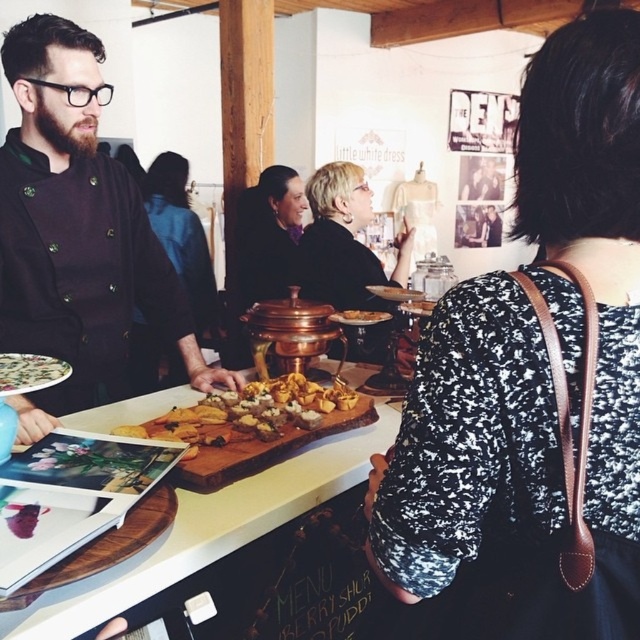
From the picture: Between black textured dress at center and matte black dress at center, which one appears on the right side from the viewer's perspective?

From the viewer's perspective, black textured dress at center appears more on the right side.

Who is positioned more to the left, black textured dress at center or matte black dress at center?

From the viewer's perspective, matte black dress at center appears more on the left side.

Which is behind, point (440, 333) or point (344, 259)?

The point (344, 259) is behind.

The image size is (640, 640). Find the location of `black textured dress at center`. black textured dress at center is located at coordinates (532, 387).

Who is positioned more to the left, matte black dress at center or matte white plate at lower left?

matte white plate at lower left

Does matte black dress at center have a larger size compared to matte white plate at lower left?

Indeed, matte black dress at center has a larger size compared to matte white plate at lower left.

Where is `matte black dress at center`? This screenshot has width=640, height=640. matte black dress at center is located at coordinates click(344, 243).

Is point (77, 609) positioned before point (33, 364)?

Yes, point (77, 609) is closer to viewer.

Identify the location of wooden cutting board at center. (236, 518).

Where is `wooden cutting board at center`? wooden cutting board at center is located at coordinates (236, 518).